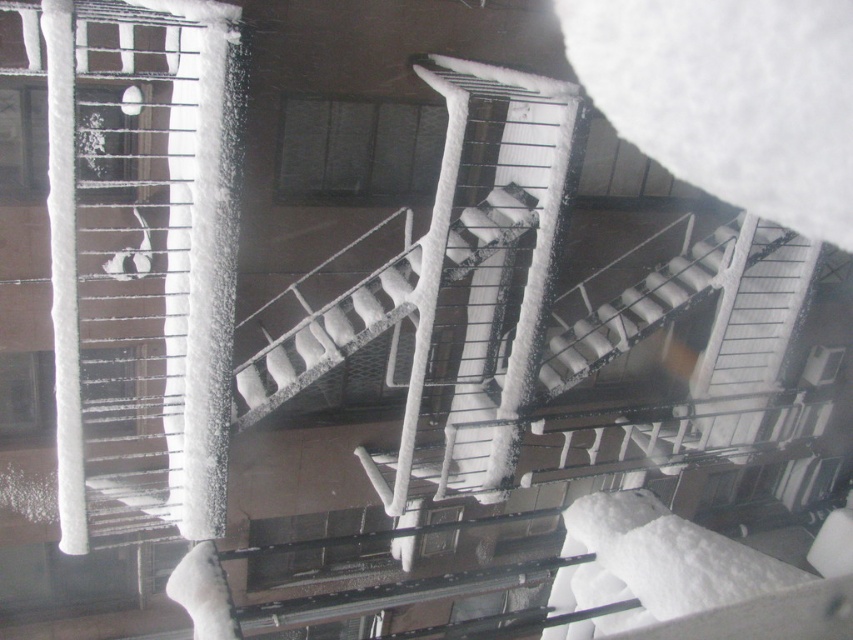
Can you confirm if snow-covered metal stairs at center is thinner than white matte stair at center?

Yes.

Which is above, snow-covered metal stairs at center or white matte stair at center?

white matte stair at center is higher up.

This screenshot has width=853, height=640. What are the coordinates of `snow-covered metal stairs at center` in the screenshot? It's located at (323, 333).